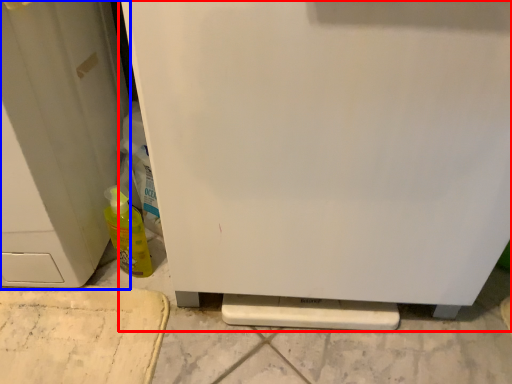
Question: Among these objects, which one is nearest to the camera, refrigerator (highlighted by a red box) or door (highlighted by a blue box)?

Choices:
 (A) refrigerator
 (B) door

Answer: (A)